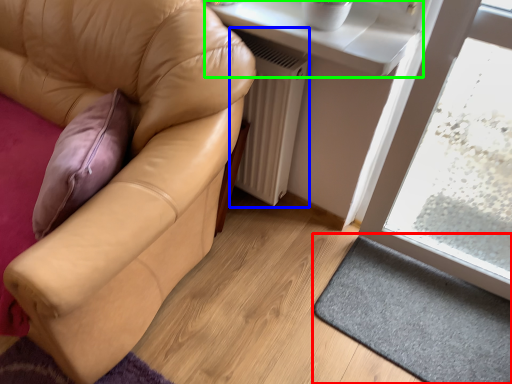
Question: Which object is the farthest from doormat (highlighted by a red box)? Choose among these: radiator (highlighted by a blue box) or window sill (highlighted by a green box).

Choices:
 (A) radiator
 (B) window sill

Answer: (B)